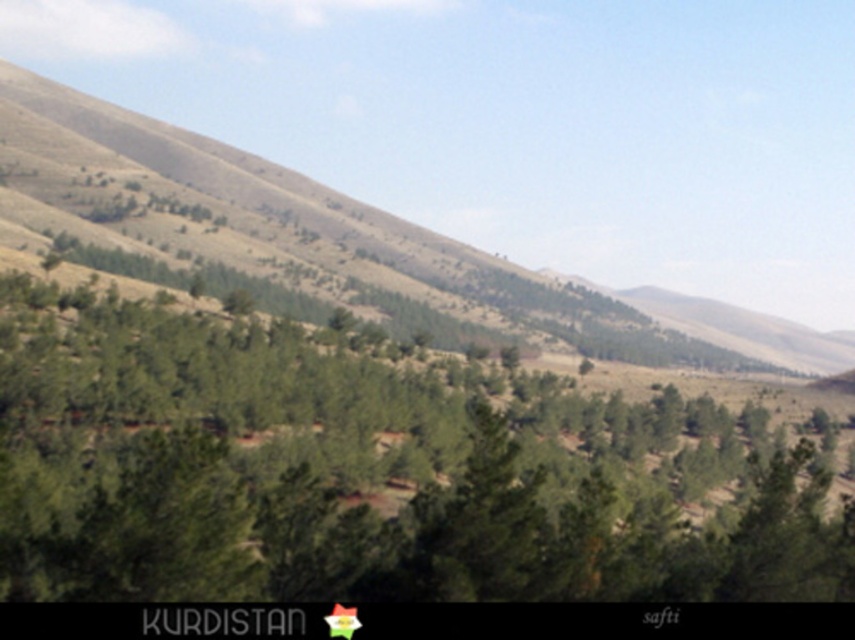
Is point (32, 560) positioned after point (749, 324)?

That is False.

The image size is (855, 640). Describe the element at coordinates (369, 476) in the screenshot. I see `green leafy tree at center` at that location.

Between point (820, 560) and point (450, 240), which one is positioned behind?

The point (450, 240) is behind.

This screenshot has height=640, width=855. What are the coordinates of `green leafy tree at center` in the screenshot? It's located at (369, 476).